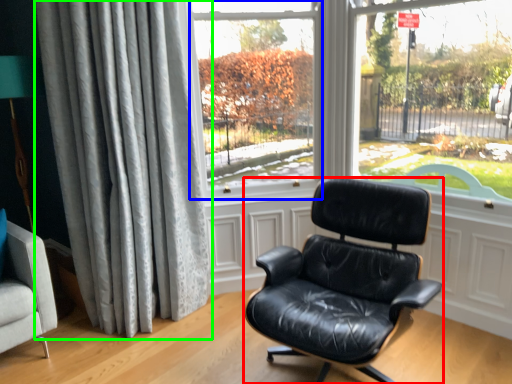
Question: Which object is the farthest from chair (highlighted by a red box)? Choose among these: window screen (highlighted by a blue box) or curtain (highlighted by a green box).

Choices:
 (A) window screen
 (B) curtain

Answer: (A)